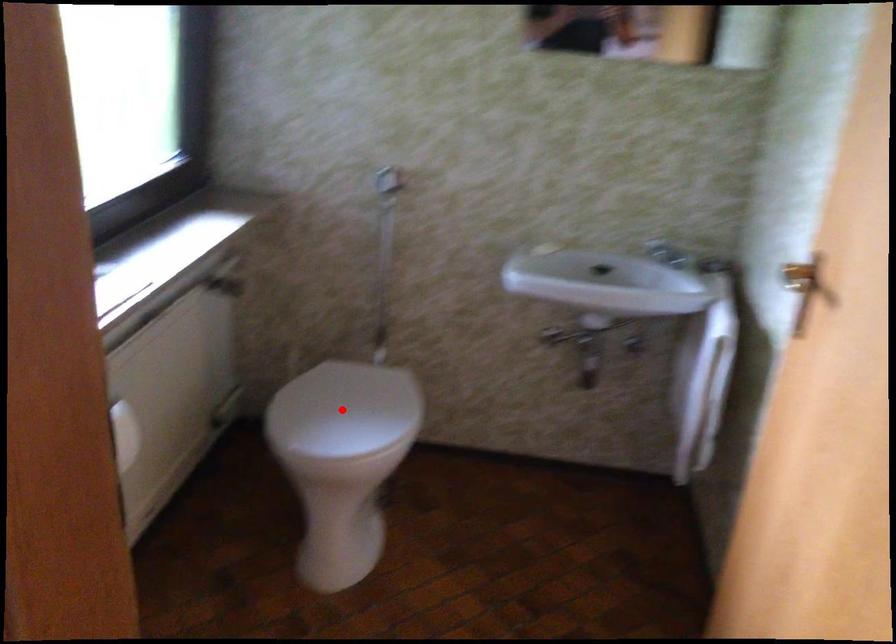
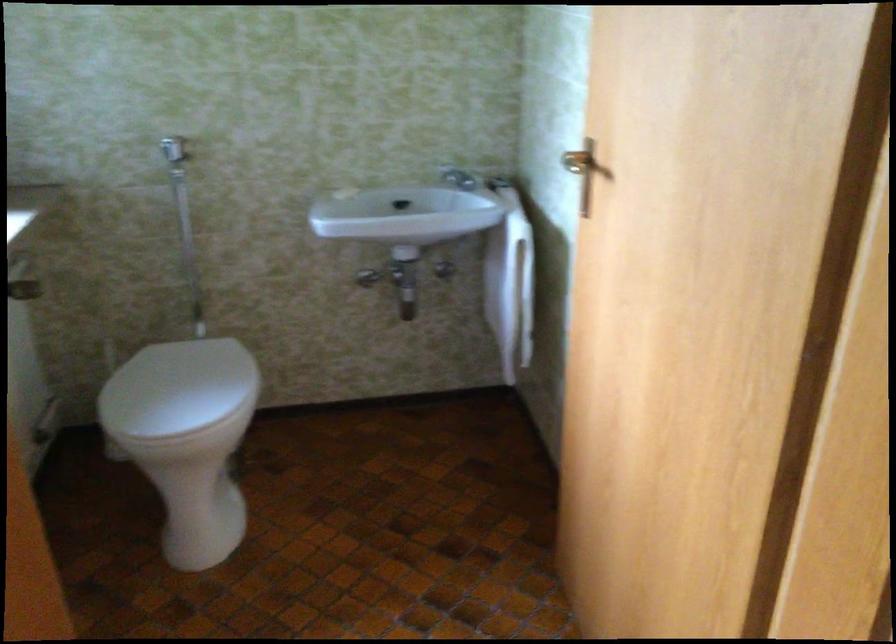
Locate, in the second image, the point that corresponds to the highlighted location in the first image.

(177, 388)